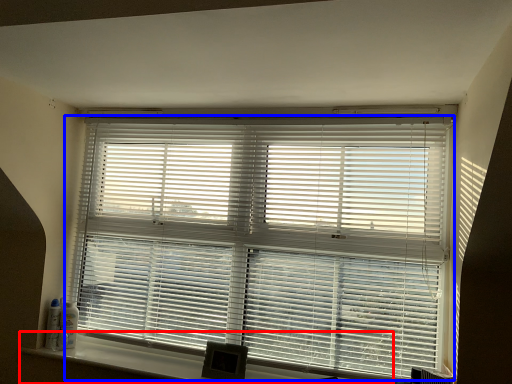
Question: Which of the following is the farthest to the observer, window sill (highlighted by a red box) or window blind (highlighted by a blue box)?

Choices:
 (A) window sill
 (B) window blind

Answer: (B)